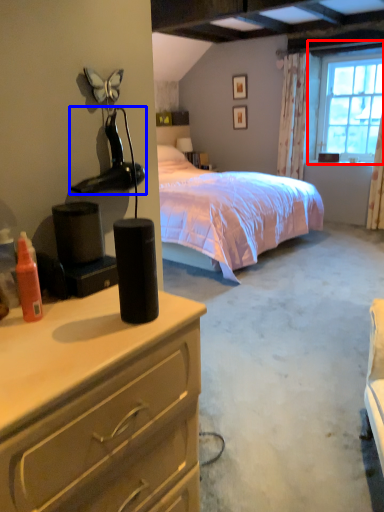
Question: Which object is further to the camera taking this photo, window (highlighted by a red box) or lamp (highlighted by a blue box)?

Choices:
 (A) window
 (B) lamp

Answer: (A)